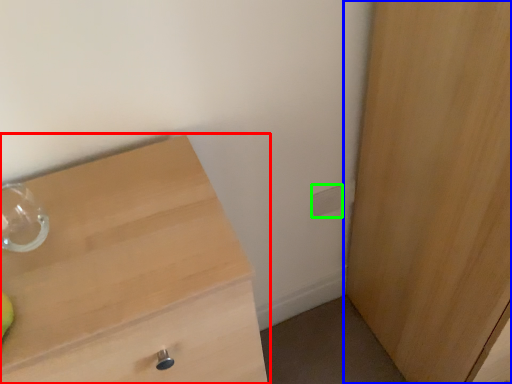
Question: Which object is the farthest from chest of drawers (highlighted by a red box)? Choose among these: cupboard (highlighted by a blue box) or electric outlet (highlighted by a green box).

Choices:
 (A) cupboard
 (B) electric outlet

Answer: (B)